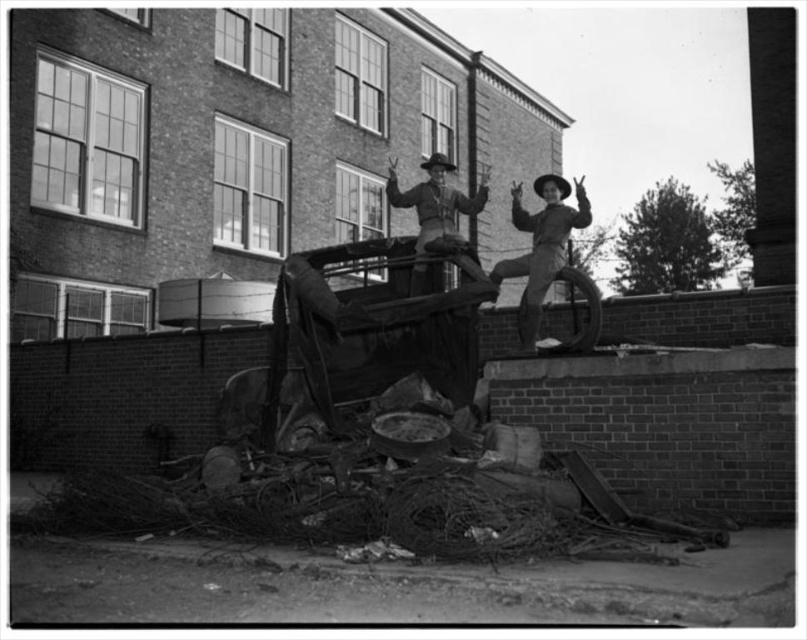
Question: Does rusty metal debris at lower center lie behind matte black cowboy hat at upper right?

Choices:
 (A) yes
 (B) no

Answer: (B)

Question: Which point appears farthest from the camera in this image?

Choices:
 (A) (456, 205)
 (B) (236, 422)

Answer: (A)

Question: Can you confirm if rusty metal debris at lower center is bigger than matte leather cowboy hat at center?

Choices:
 (A) yes
 (B) no

Answer: (B)

Question: Which point is farther to the camera?

Choices:
 (A) (546, 189)
 (B) (437, 211)

Answer: (B)

Question: Which point is closer to the camera taking this photo?

Choices:
 (A) (241, 472)
 (B) (442, 177)

Answer: (A)

Question: In this image, where is rusty metal debris at lower center located relative to matte leather cowboy hat at center?

Choices:
 (A) right
 (B) left

Answer: (B)